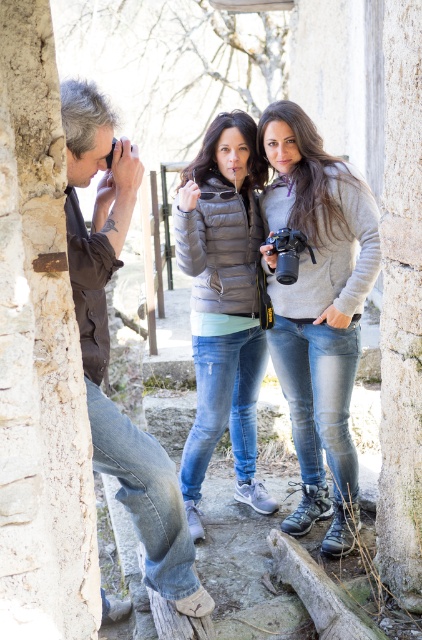
You are a photographer trying to capture a photo of the two women in the center. You notice the brown leather jacket at left and the black plastic camera at upper left in your viewfinder. Which object will appear closer to the viewer in the final photograph?

The brown leather jacket at left will appear closer to the viewer in the final photograph because it is positioned in front of the black plastic camera at upper left.

You are a photographer trying to capture the scene. You notice the brown leather jacket at left and the black plastic camera at upper left. Which object is closer to the ground?

The brown leather jacket at left is positioned under the black plastic camera at upper left, so it is closer to the ground.

You are a photographer trying to decide which black plastic camera to use for a wide shot. The black plastic camera at center and the black plastic camera at upper left are both available. Which one has a wider field of view?

The black plastic camera at center has a wider field of view because its width surpasses that of the black plastic camera at upper left.